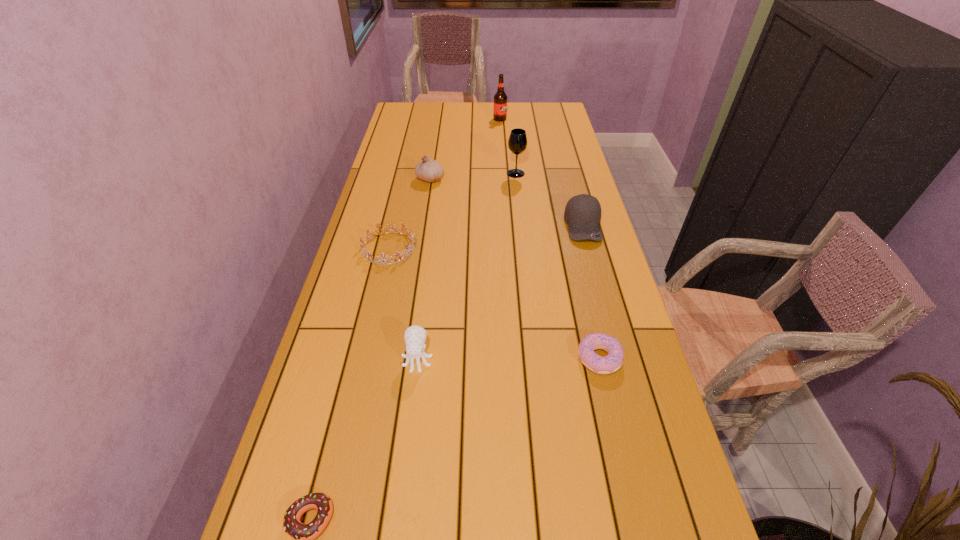
The height and width of the screenshot is (540, 960). I want to click on object that is the fourth closest one to the right doughnut, so coord(303,534).